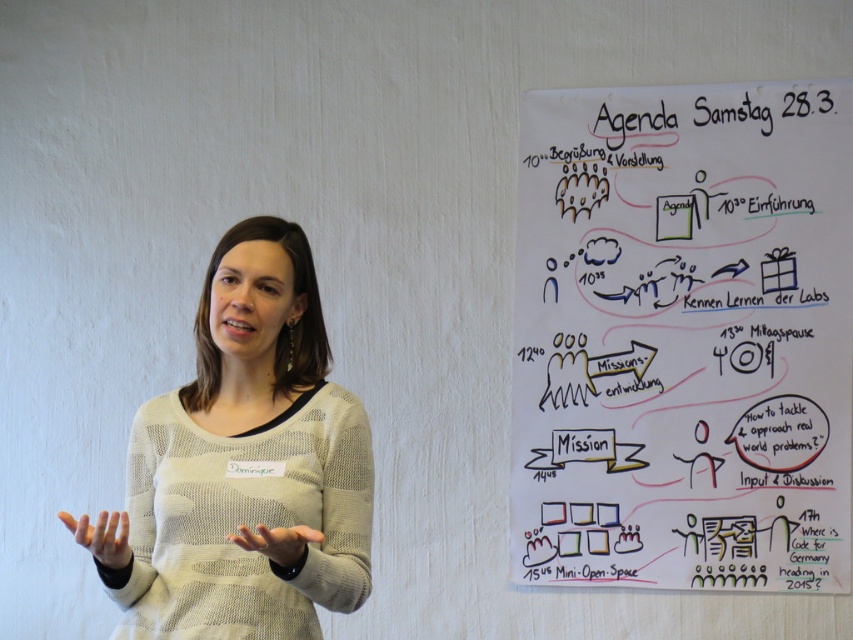
Question: Which of the following is the closest to the observer?

Choices:
 (A) click(97, 545)
 (B) click(572, 145)

Answer: (A)

Question: Can you confirm if white paper at upper right is thinner than matte skin hand at center?

Choices:
 (A) no
 (B) yes

Answer: (A)

Question: Does white paper at upper right come in front of matte skin hand at center?

Choices:
 (A) yes
 (B) no

Answer: (B)

Question: Which object appears closest to the camera in this image?

Choices:
 (A) smooth beige sweater at center
 (B) knit sweater at left
 (C) white paper at upper right

Answer: (A)

Question: Which point is closer to the camera taking this photo?

Choices:
 (A) (234, 532)
 (B) (126, 545)

Answer: (B)

Question: Considering the relative positions of knit sweater at left and matte skin hand at center in the image provided, where is knit sweater at left located with respect to matte skin hand at center?

Choices:
 (A) above
 (B) below

Answer: (A)